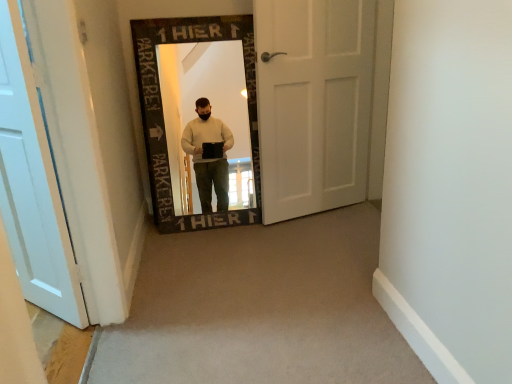
At what (x,y) coordinates should I click in order to perform the action: click on vacant space in front of white painted wood door at left, which is the first door from left to right. Please return your answer as a coordinate pair (x, y). Looking at the image, I should click on click(x=49, y=339).